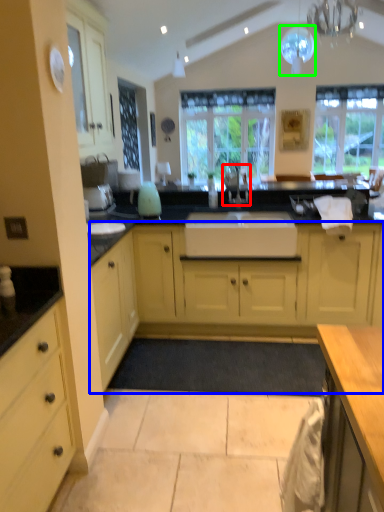
Question: Which object is positioned farthest from faucet (highlighted by a red box)? Select from cabinetry (highlighted by a blue box) and light fixture (highlighted by a green box).

Choices:
 (A) cabinetry
 (B) light fixture

Answer: (B)